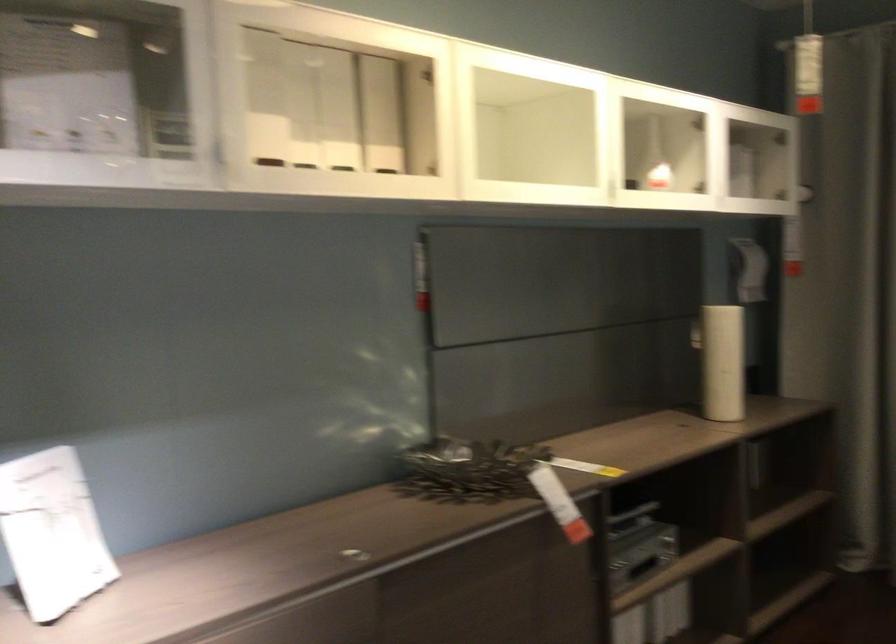
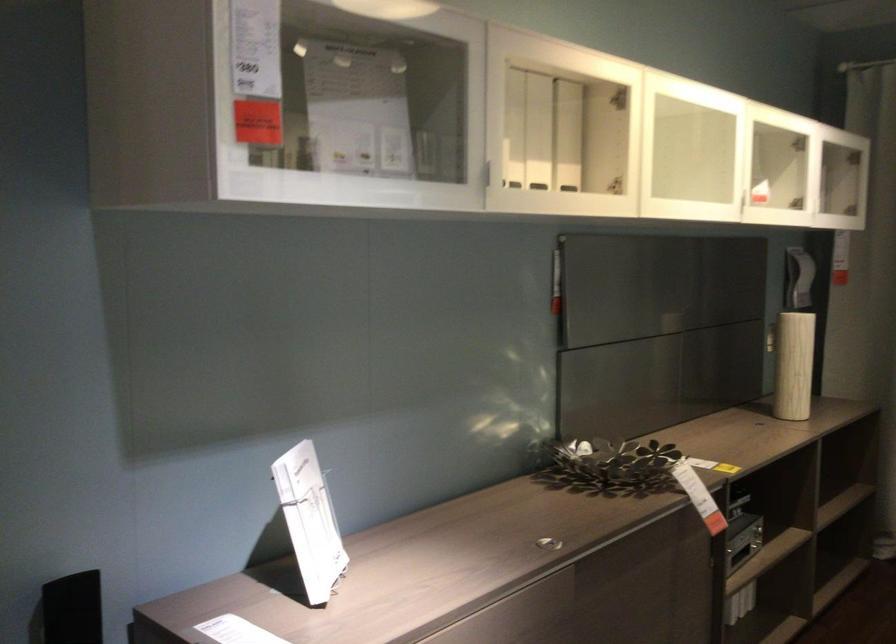
Find the pixel in the second image that matches point (303, 108) in the first image.

(513, 128)